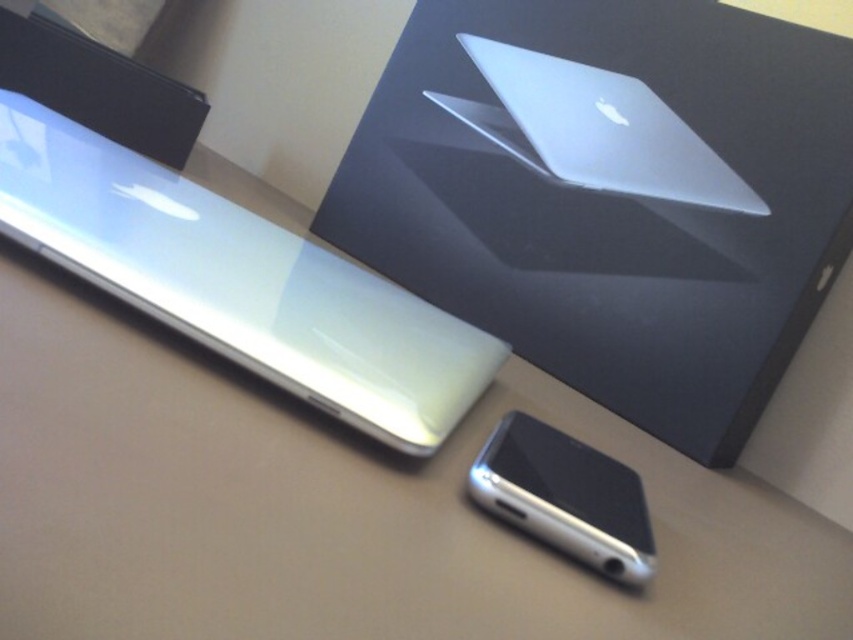
You are an Apple store employee arranging products on a shelf. You have to place the sleek silver laptop at upper center and the glossy white tablet at upper left. According to the current arrangement, which device is placed above the other?

The sleek silver laptop at upper center is positioned over the glossy white tablet at upper left, meaning it is placed above the tablet.

You are an Apple store employee arranging devices on a display table. You have a glossy white tablet at upper left and a silver metallic smartphone at lower center. Which device should you place in a larger storage compartment if you need to pack them away?

The glossy white tablet at upper left is larger in size than the silver metallic smartphone at lower center, so it should be placed in the larger storage compartment.